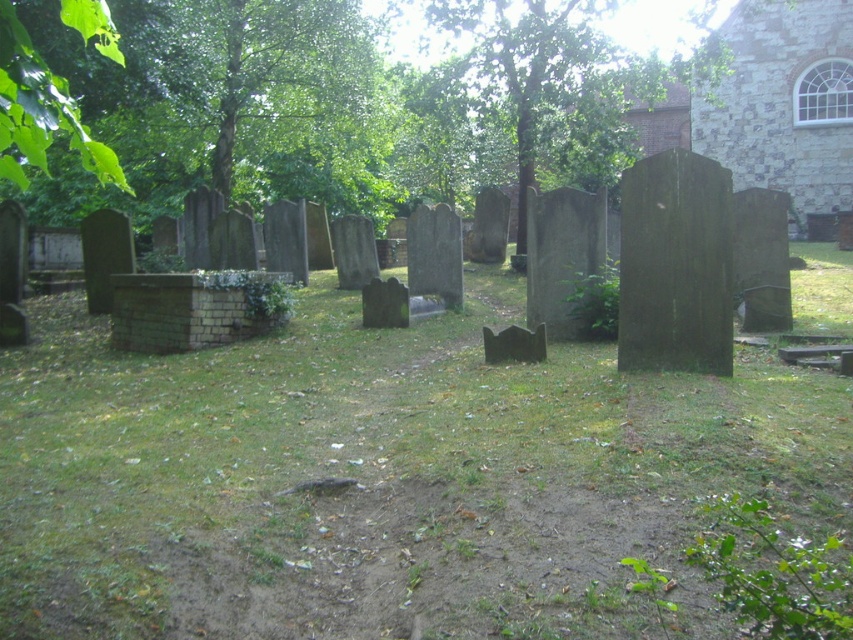
Which is below, green grass at center or green leafy tree at upper center?

Positioned lower is green grass at center.

Between point (438, 460) and point (486, 22), which one is positioned behind?

The point (486, 22) is more distant.

The width and height of the screenshot is (853, 640). Describe the element at coordinates (381, 477) in the screenshot. I see `green grass at center` at that location.

Locate an element on the screen. This screenshot has height=640, width=853. green grass at center is located at coordinates (381, 477).

Can you confirm if brown stone church at upper right is positioned above green leafy tree at upper center?

No, brown stone church at upper right is not above green leafy tree at upper center.

This screenshot has height=640, width=853. In order to click on brown stone church at upper right in this screenshot , I will do `click(770, 106)`.

Where is `brown stone church at upper right`? brown stone church at upper right is located at coordinates (770, 106).

Is green grass at center below brown stone church at upper right?

Yes.

Between point (337, 612) and point (688, 112), which one is positioned behind?

Point (688, 112)

This screenshot has height=640, width=853. I want to click on green grass at center, so click(x=381, y=477).